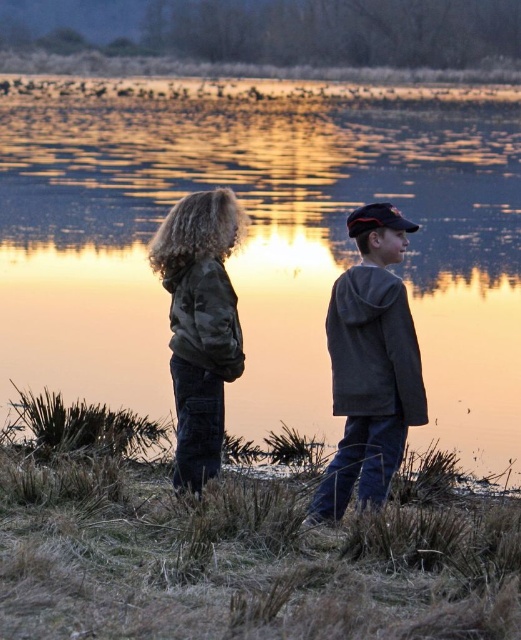
Between point (478, 404) and point (237, 356), which one is positioned in front?

Point (237, 356) is more forward.

Who is higher up, glistening water at center or camo jacket at center?

glistening water at center is above.

Image resolution: width=521 pixels, height=640 pixels. What are the coordinates of `glistening water at center` in the screenshot? It's located at (262, 240).

Which is in front, point (293, 144) or point (399, 408)?

Point (399, 408) is more forward.

Can you confirm if glistening water at center is positioned to the right of camouflage jacket at center?

No, glistening water at center is not to the right of camouflage jacket at center.

This screenshot has width=521, height=640. Find the location of `glistening water at center`. glistening water at center is located at coordinates (262, 240).

Can you confirm if camouflage jacket at center is thinner than gray fleece jacket at center?

Correct, camouflage jacket at center's width is less than gray fleece jacket at center's.

Is camouflage jacket at center to the left of gray fleece jacket at center from the viewer's perspective?

Answer: No, camouflage jacket at center is not to the left of gray fleece jacket at center.

Image resolution: width=521 pixels, height=640 pixels. What are the coordinates of `camouflage jacket at center` in the screenshot? It's located at (370, 364).

Identify the location of camouflage jacket at center. (370, 364).